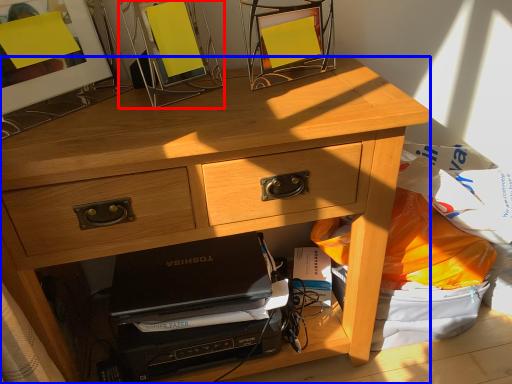
Question: Which object is closer to the camera taking this photo, picture frame (highlighted by a red box) or desk (highlighted by a blue box)?

Choices:
 (A) picture frame
 (B) desk

Answer: (B)